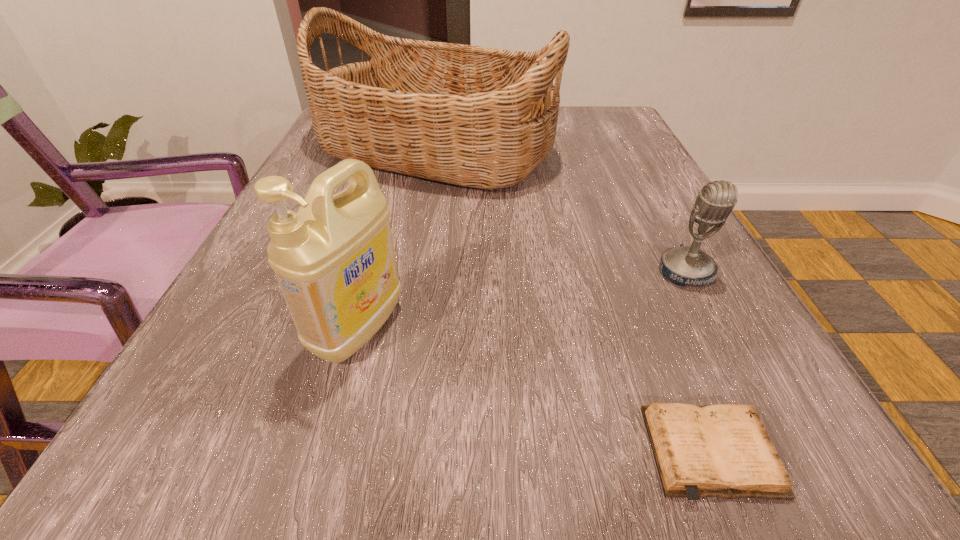
This screenshot has width=960, height=540. I want to click on vacant area that lies between the shortest object and the farthest object, so click(574, 302).

Where is `free space between the basket and the diary`? free space between the basket and the diary is located at coordinates (574, 302).

Where is `empty space that is in between the detergent and the second shortest object`? Image resolution: width=960 pixels, height=540 pixels. empty space that is in between the detergent and the second shortest object is located at coordinates (522, 300).

Where is `object that stands as the closest to the farthest object`? This screenshot has height=540, width=960. object that stands as the closest to the farthest object is located at coordinates (685, 265).

Locate which object is the third closest to the detergent. Please provide its 2D coordinates. Your answer should be formatted as a tuple, i.e. [(x, y)], where the tuple contains the x and y coordinates of a point satisfying the conditions above.

[(685, 265)]